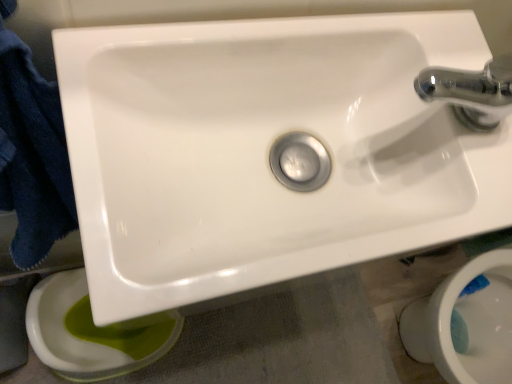
Question: Visually, is white glossy sink at center positioned to the left or to the right of white glossy toilet bowl at lower right, which is the first toilet bowl from right to left?

Choices:
 (A) right
 (B) left

Answer: (B)

Question: Looking at their shapes, would you say white glossy sink at center is wider or thinner than white glossy toilet bowl at lower right, the second toilet bowl positioned from the left?

Choices:
 (A) thin
 (B) wide

Answer: (A)

Question: Which of these objects is positioned closest to the dark blue towel at left?

Choices:
 (A) white glossy toilet bowl at lower right, which is the first toilet bowl from right to left
 (B) green glossy toilet bowl at lower left, the 1th toilet bowl viewed from the left
 (C) white glossy sink at center

Answer: (C)

Question: Estimate the real-world distances between objects in this image. Which object is closer to the green glossy toilet bowl at lower left, the 1th toilet bowl viewed from the left?

Choices:
 (A) white glossy sink at center
 (B) white glossy toilet bowl at lower right, the second toilet bowl positioned from the left
 (C) dark blue towel at left

Answer: (C)